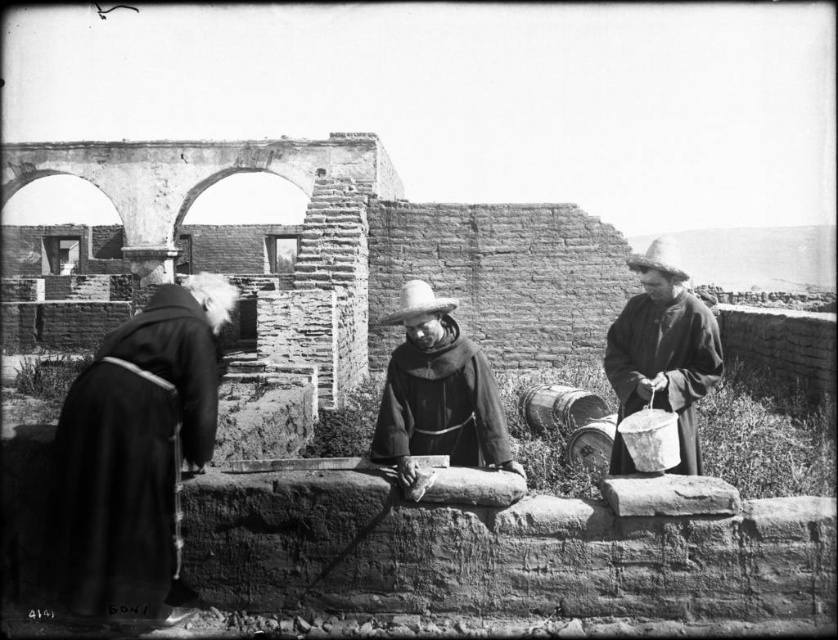
Can you confirm if smooth brown robe at center is positioned below dark brown woolen robe at right?

Yes.

Does smooth brown robe at center have a greater width compared to dark brown woolen robe at right?

No.

Is point (407, 438) positioned in front of point (618, 323)?

Yes.

You are a GUI agent. You are given a task and a screenshot of the screen. Output one action in this format:
    pyautogui.click(x=<x>, y=<y>)
    Task: Click on the smooth brown robe at center
    The width and height of the screenshot is (838, 640).
    Given the screenshot: What is the action you would take?
    pyautogui.click(x=440, y=403)

Is point (58, 557) closer to viewer compared to point (619, 356)?

Yes, it is.

Who is lower down, dark woolen robe at left or dark brown woolen robe at right?

Positioned lower is dark woolen robe at left.

Who is more distant from viewer, (138, 557) or (709, 384)?

Point (709, 384)

Identify the location of dark woolen robe at left. (133, 456).

Which is behind, point (159, 611) or point (484, 420)?

The point (484, 420) is more distant.

Image resolution: width=838 pixels, height=640 pixels. Find the location of `dark woolen robe at left`. dark woolen robe at left is located at coordinates (133, 456).

Does point (123, 493) come in front of point (505, 454)?

Yes, it is.

Identify the location of dark woolen robe at left. The height and width of the screenshot is (640, 838). (133, 456).